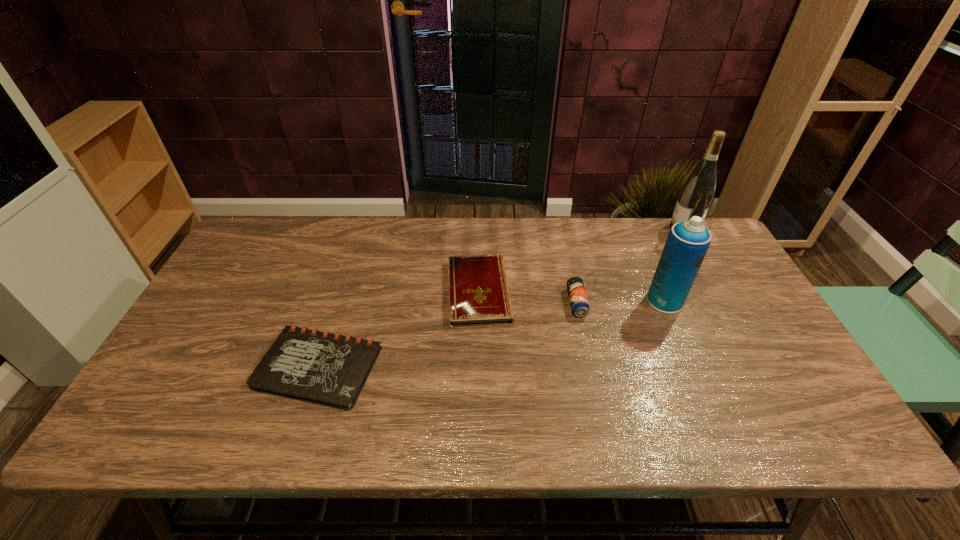
You are a GUI agent. You are given a task and a screenshot of the screen. Output one action in this format:
    pyautogui.click(x=<x>, y=<y>)
    Task: Click on the free space between the farthest object and the third tallest object
    
    Given the screenshot: What is the action you would take?
    pyautogui.click(x=630, y=265)

The height and width of the screenshot is (540, 960). Identify the location of unoccupied area between the second tallest object and the third object from left to right. (621, 301).

Locate an element on the screen. The height and width of the screenshot is (540, 960). vacant space that's between the fourth shortest object and the nearest object is located at coordinates [x=492, y=334].

You are a GUI agent. You are given a task and a screenshot of the screen. Output one action in this format:
    pyautogui.click(x=<x>, y=<y>)
    Task: Click on the empty space that is in between the beer can and the second object from left to right
    This screenshot has height=540, width=960.
    Given the screenshot: What is the action you would take?
    pyautogui.click(x=528, y=297)

Locate an element on the screen. This screenshot has width=960, height=540. empty space between the third tallest object and the farthest object is located at coordinates (630, 265).

Locate which object is the closest to the second tallest object. Please provide its 2D coordinates. Your answer should be formatted as a tuple, i.e. [(x, y)], where the tuple contains the x and y coordinates of a point satisfying the conditions above.

[(579, 303)]

Where is `object that stands as the closest to the nearer notebook`? The image size is (960, 540). object that stands as the closest to the nearer notebook is located at coordinates (479, 295).

You are a GUI agent. You are given a task and a screenshot of the screen. Output one action in this format:
    pyautogui.click(x=<x>, y=<y>)
    Task: Click on the free space that satisfies the following two spatial constraints: 1. on the label of the wine bottle; 2. on the front side of the left notebook
    Image resolution: width=960 pixels, height=540 pixels.
    Given the screenshot: What is the action you would take?
    pyautogui.click(x=762, y=368)

This screenshot has height=540, width=960. Identify the location of vacant region that satisfies the following two spatial constraints: 1. on the back side of the left notebook; 2. on the left side of the third tallest object. (339, 302).

Locate an element on the screen. The image size is (960, 540). vacant space that satisfies the following two spatial constraints: 1. on the back side of the third shortest object; 2. on the right side of the fourth shortest object is located at coordinates (576, 301).